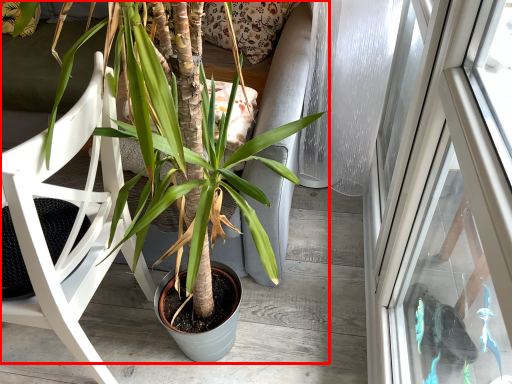
Question: In this image, where is houseplant (annotated by the red box) located relative to chair?

Choices:
 (A) left
 (B) right

Answer: (B)